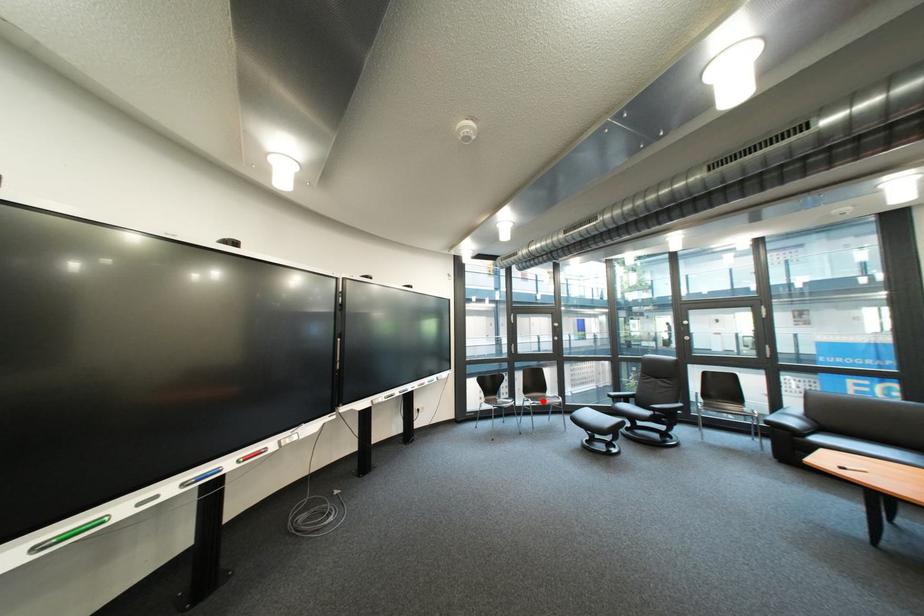
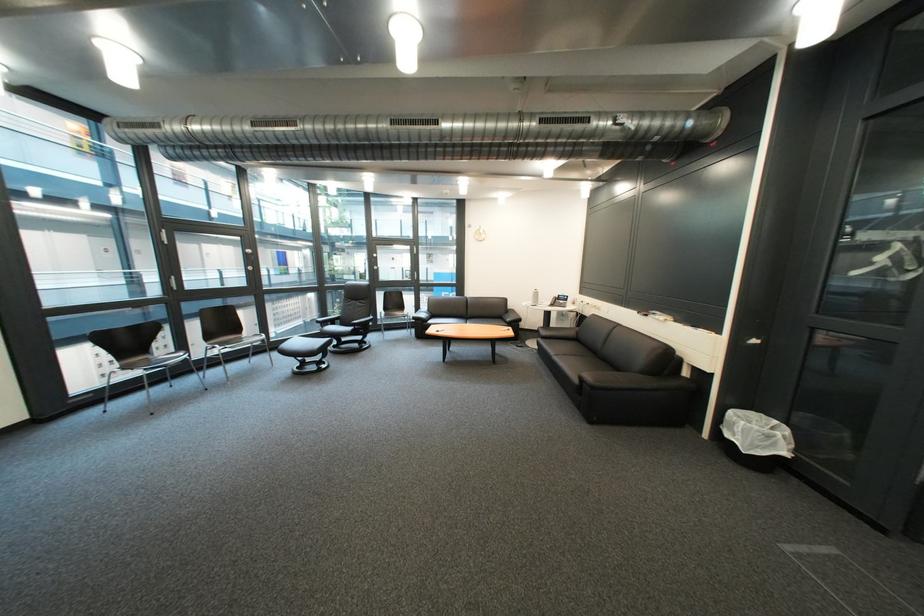
Question: I am providing you with two images of the same scene from different viewpoints. A red point is shown in image1. For the corresponding object point in image2, is it positioned nearer or farther from the camera?

Choices:
 (A) Nearer
 (B) Farther

Answer: (A)